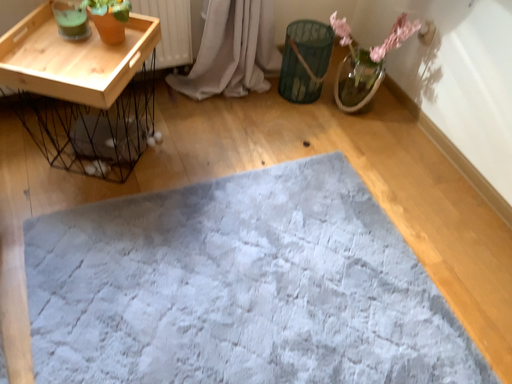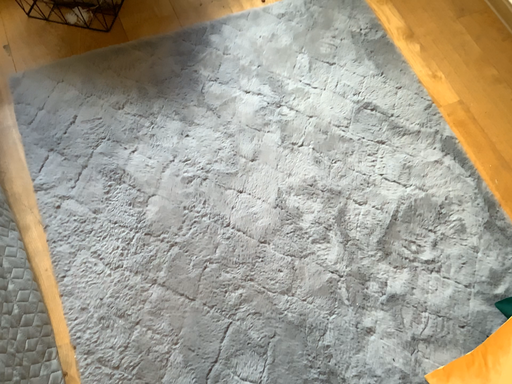
Question: Which way did the camera rotate in the video?

Choices:
 (A) rotated downward
 (B) rotated upward

Answer: (A)